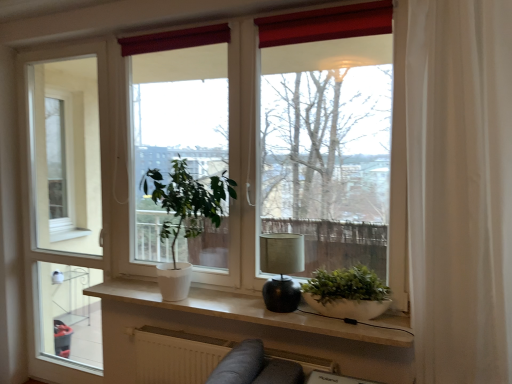
Identify the location of vacant space underneath green matte plant at center, which appears as the 2th houseplant when viewed from the left (from a real-world perspective). (335, 312).